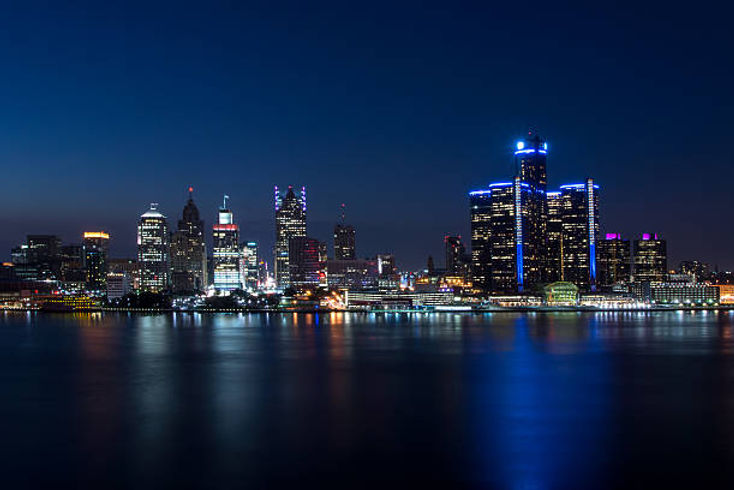
Find the location of a particular element. The width and height of the screenshot is (734, 490). purple light is located at coordinates click(652, 234), click(614, 241).